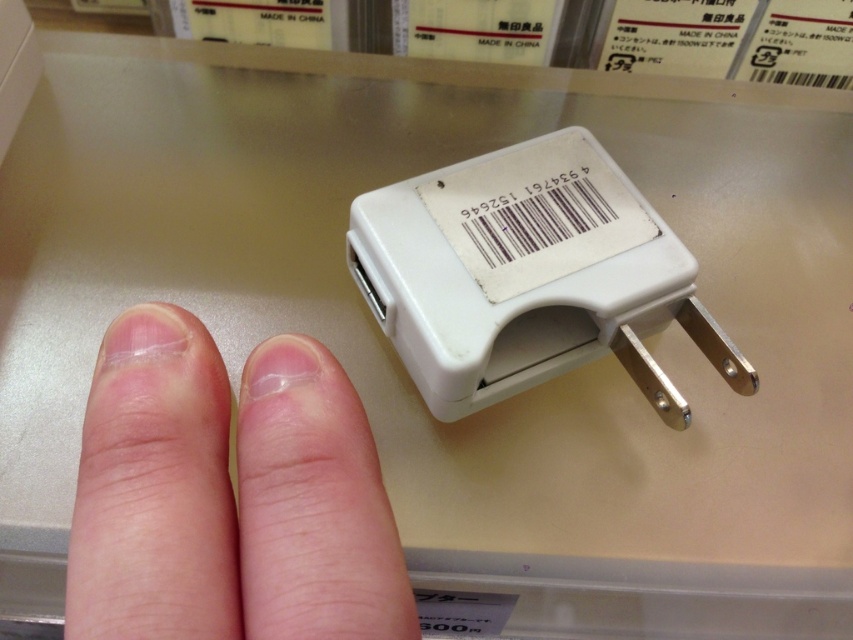
Question: Which point is closer to the camera?

Choices:
 (A) (547, 150)
 (B) (285, 464)

Answer: (B)

Question: Does pink flesh-toned fingers at center appear over white plastic plug at center?

Choices:
 (A) yes
 (B) no

Answer: (B)

Question: Observing the image, what is the correct spatial positioning of pink flesh-toned fingers at center in reference to white plastic plug at center?

Choices:
 (A) right
 (B) left

Answer: (B)

Question: Is pink flesh-toned fingers at center below white plastic plug at center?

Choices:
 (A) yes
 (B) no

Answer: (A)